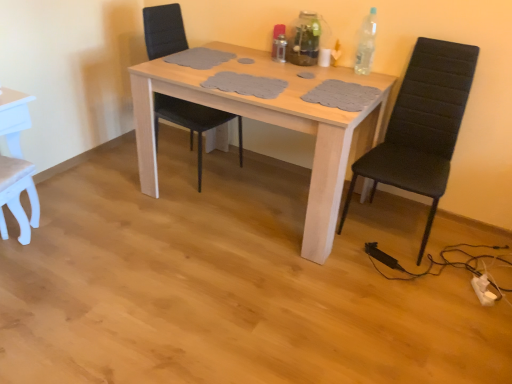
Identify the location of unoccupied area in front of black fabric chair at right, marked as the 1th chair in a right-to-left arrangement. (409, 289).